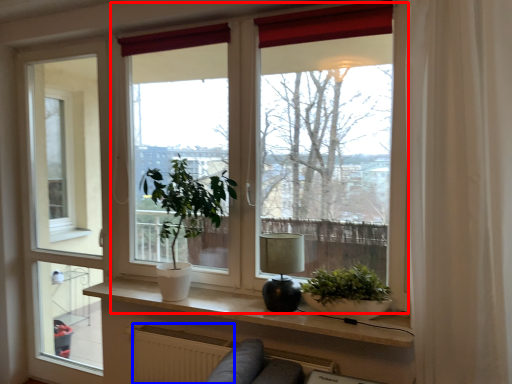
Question: Which point is closer to the camera, window (highlighted by a red box) or radiator (highlighted by a blue box)?

Choices:
 (A) window
 (B) radiator

Answer: (B)